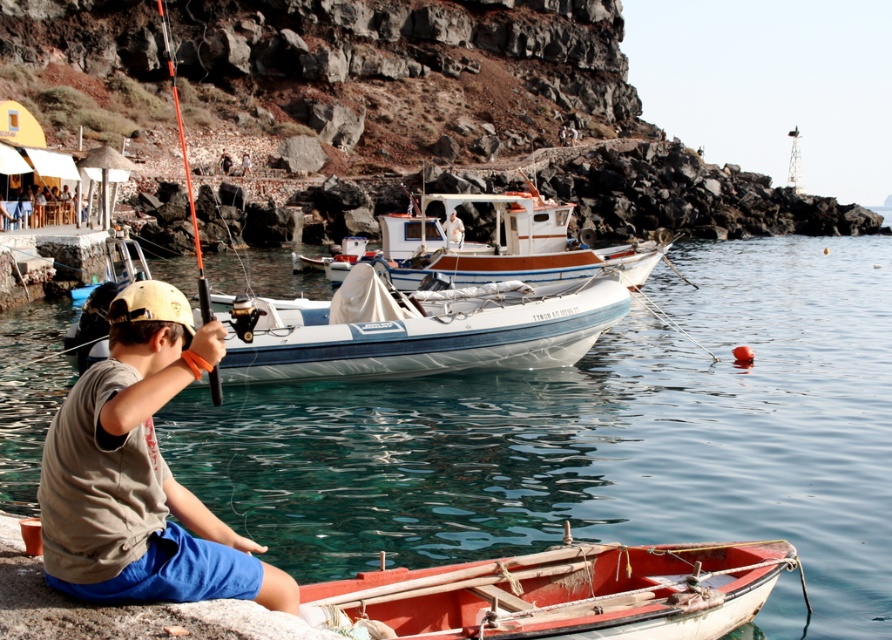
Looking at this image, you are standing at the camera position and want to reach the point marked at coordinates (125, 493). If your walking speed is 3 feet per second, how many seconds will it take you to reach that point?

The point at coordinates (125, 493) is 27.73 feet away from the camera. At a walking speed of 3 feet per second, it would take approximately 9.24 seconds to reach that point.